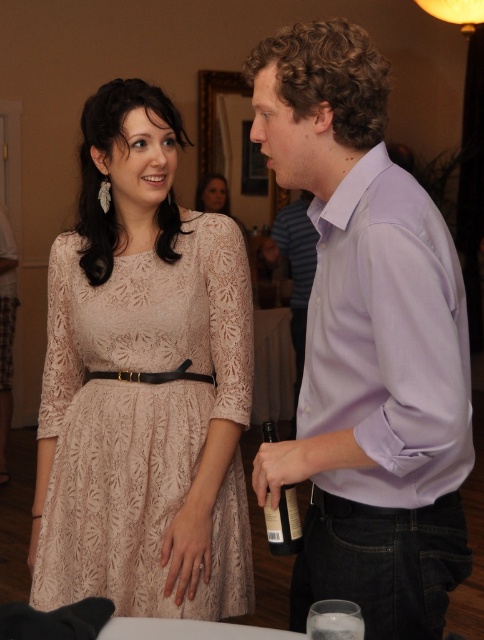
Question: Is dark brown glass bottle at lower center above lace fabric dress at center?

Choices:
 (A) yes
 (B) no

Answer: (B)

Question: Among these objects, which one is farthest from the camera?

Choices:
 (A) transparent glass at lower center
 (B) purple cotton shirt at center
 (C) lace fabric dress at left

Answer: (B)

Question: Is purple cotton shirt at center positioned behind lace fabric dress at center?

Choices:
 (A) yes
 (B) no

Answer: (B)

Question: Observing the image, what is the correct spatial positioning of lavender cotton shirt at right in reference to transparent glass at lower center?

Choices:
 (A) right
 (B) left

Answer: (A)

Question: Which point is closer to the camera taking this photo?

Choices:
 (A) (360, 637)
 (B) (315, 241)
 (C) (300, 541)

Answer: (A)

Question: Which of these objects is positioned closest to the lace fabric dress at center?

Choices:
 (A) purple cotton shirt at center
 (B) lavender cotton shirt at right
 (C) dark brown glass bottle at lower center

Answer: (A)